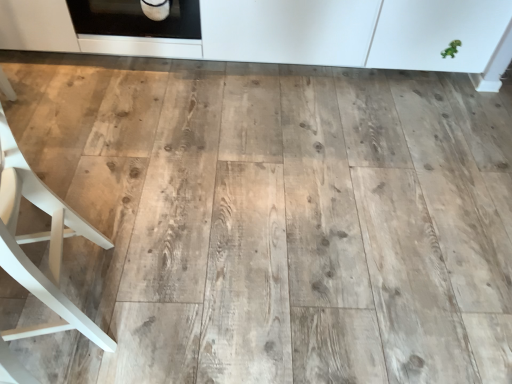
Image resolution: width=512 pixels, height=384 pixels. What do you see at coordinates (31, 261) in the screenshot?
I see `white wood chair at left` at bounding box center [31, 261].

Locate an element on the screen. white wood chair at left is located at coordinates point(31,261).

At what (x,y) coordinates should I click in order to perform the action: click on white wood chair at left. Please return your answer as a coordinate pair (x, y). The width and height of the screenshot is (512, 384). Looking at the image, I should click on (31, 261).